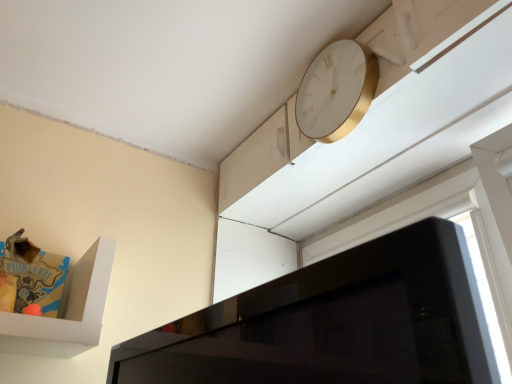
Image resolution: width=512 pixels, height=384 pixels. I want to click on white gold clock at upper right, so click(336, 91).

Describe the element at coordinates (336, 91) in the screenshot. I see `white gold clock at upper right` at that location.

What is the approximate width of white gold clock at upper right?

3.11 inches.

Describe the element at coordinates (444, 218) in the screenshot. The height and width of the screenshot is (384, 512). I see `white glossy window at upper right` at that location.

At what (x,y) coordinates should I click in order to perform the action: click on white glossy window at upper right. Please return your answer as a coordinate pair (x, y). Image resolution: width=512 pixels, height=384 pixels. Looking at the image, I should click on coord(444,218).

The image size is (512, 384). In order to click on white gold clock at upper right in this screenshot , I will do `click(336, 91)`.

Based on their positions, is white gold clock at upper right located to the left or right of white glossy window at upper right?

Clearly, white gold clock at upper right is on the left of white glossy window at upper right in the image.

Between white gold clock at upper right and white glossy window at upper right, which one is positioned in front?

white glossy window at upper right is closer to the camera.

Which point is more distant from viewer, [359,43] or [480,255]?

The point [359,43] is more distant.

From the image's perspective, between white gold clock at upper right and white glossy window at upper right, who is located below?

white glossy window at upper right appears lower in the image.

From a real-world perspective, who is located higher, white gold clock at upper right or white glossy window at upper right?

white gold clock at upper right.

Is white gold clock at upper right wider or thinner than white glossy window at upper right?

In the image, white gold clock at upper right appears to be more narrow than white glossy window at upper right.

Who is shorter, white gold clock at upper right or white glossy window at upper right?

white gold clock at upper right.

Who is smaller, white gold clock at upper right or white glossy window at upper right?

With smaller size is white gold clock at upper right.

In the scene shown: Is white glossy window at upper right located within white gold clock at upper right?

No, white glossy window at upper right is not inside white gold clock at upper right.

Is white gold clock at upper right touching white glossy window at upper right?

There is a gap between white gold clock at upper right and white glossy window at upper right.

Is white glossy window at upper right at the back of white gold clock at upper right?

That's not correct — white gold clock at upper right is not looking away from white glossy window at upper right.

Measure the distance between white gold clock at upper right and white glossy window at upper right.

white gold clock at upper right is 19.24 inches away from white glossy window at upper right.

You are a GUI agent. You are given a task and a screenshot of the screen. Output one action in this format:
    pyautogui.click(x=<x>, y=<y>)
    Task: Click on the clock on the left of white glossy window at upper right
    The image size is (512, 384).
    Given the screenshot: What is the action you would take?
    coord(336,91)

Can you confirm if white glossy window at upper right is positioned to the left of white gold clock at upper right?

In fact, white glossy window at upper right is to the right of white gold clock at upper right.

Is the depth of white glossy window at upper right greater than that of white gold clock at upper right?

No, white glossy window at upper right is closer to the camera.

Does point (417, 204) appear closer or farther from the camera than point (356, 114)?

Point (417, 204) is farther from the camera than point (356, 114).

From the image's perspective, between white glossy window at upper right and white gold clock at upper right, which one is located above?

From the image's view, white gold clock at upper right is above.

From a real-world perspective, is white glossy window at upper right over white gold clock at upper right?

No.

Which of these two, white glossy window at upper right or white gold clock at upper right, is thinner?

With smaller width is white gold clock at upper right.

Does white glossy window at upper right have a greater height compared to white gold clock at upper right?

Yes.

Which of these two, white glossy window at upper right or white gold clock at upper right, is smaller?

white gold clock at upper right is smaller.

Can we say white glossy window at upper right lies outside white gold clock at upper right?

Indeed, white glossy window at upper right is completely outside white gold clock at upper right.

Is white glossy window at upper right not close to white gold clock at upper right?

Actually, white glossy window at upper right and white gold clock at upper right are a little close together.

Is white glossy window at upper right turned away from white gold clock at upper right?

No, white glossy window at upper right is not facing away from white gold clock at upper right.

Can you tell me how much white glossy window at upper right and white gold clock at upper right differ in facing direction?

They differ by 0.844 degrees in their facing directions.

You are a GUI agent. You are given a task and a screenshot of the screen. Output one action in this format:
    pyautogui.click(x=<x>, y=<y>)
    Task: Click on the clock behind the white glossy window at upper right
    
    Given the screenshot: What is the action you would take?
    pyautogui.click(x=336, y=91)

Find the location of `window located in front of the white gold clock at upper right`. window located in front of the white gold clock at upper right is located at coordinates (444, 218).

Identify the location of clock behind the white glossy window at upper right. (336, 91).